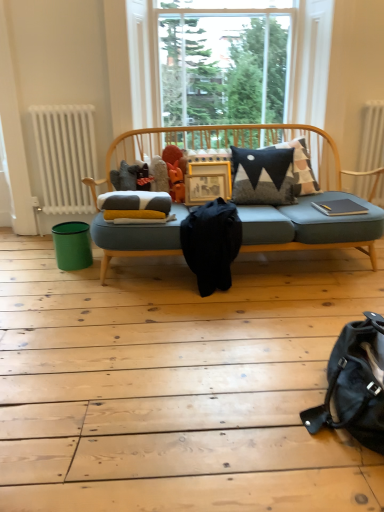
Question: Is teal plastic bin at lower left positioned far away from orange matte figurine at center?

Choices:
 (A) no
 (B) yes

Answer: (A)

Question: Is teal plastic bin at lower left positioned in front of orange matte figurine at center?

Choices:
 (A) yes
 (B) no

Answer: (A)

Question: From the image's perspective, is teal plastic bin at lower left on top of orange matte figurine at center?

Choices:
 (A) yes
 (B) no

Answer: (B)

Question: Could you tell me if teal plastic bin at lower left is facing orange matte figurine at center?

Choices:
 (A) no
 (B) yes

Answer: (A)

Question: Considering the relative sizes of teal plastic bin at lower left and orange matte figurine at center in the image provided, is teal plastic bin at lower left thinner than orange matte figurine at center?

Choices:
 (A) no
 (B) yes

Answer: (A)

Question: From a real-world perspective, is black leather messenger bag at lower right, which is the second messenger bag from left to right, positioned above or below orange matte figurine at center?

Choices:
 (A) above
 (B) below

Answer: (B)

Question: Is point (344, 351) positioned closer to the camera than point (173, 183)?

Choices:
 (A) farther
 (B) closer

Answer: (B)

Question: Relative to orange matte figurine at center, is black leather messenger bag at lower right, which ranks as the first messenger bag in bottom-to-top order, in front or behind?

Choices:
 (A) front
 (B) behind

Answer: (A)

Question: Is black leather messenger bag at lower right, arranged as the 1th messenger bag when viewed from the front, taller or shorter than orange matte figurine at center?

Choices:
 (A) tall
 (B) short

Answer: (A)

Question: Relative to orange matte figurine at center, is white radiator at left, marked as the 2th radiator in a right-to-left arrangement, in front or behind?

Choices:
 (A) behind
 (B) front

Answer: (A)

Question: From the image's perspective, relative to orange matte figurine at center, is white radiator at left, marked as the 2th radiator in a right-to-left arrangement, above or below?

Choices:
 (A) below
 (B) above

Answer: (B)

Question: Which is correct: white radiator at left, the first radiator in the left-to-right sequence, is inside orange matte figurine at center, or outside of it?

Choices:
 (A) outside
 (B) inside

Answer: (A)

Question: From their relative heights in the image, would you say white radiator at left, the first radiator in the left-to-right sequence, is taller or shorter than orange matte figurine at center?

Choices:
 (A) tall
 (B) short

Answer: (A)

Question: Is white textured radiator at upper right, the second radiator viewed from the left, inside the boundaries of wooden frame at center, or outside?

Choices:
 (A) inside
 (B) outside

Answer: (B)

Question: From the image's perspective, relative to wooden frame at center, is white textured radiator at upper right, the second radiator viewed from the left, above or below?

Choices:
 (A) above
 (B) below

Answer: (A)